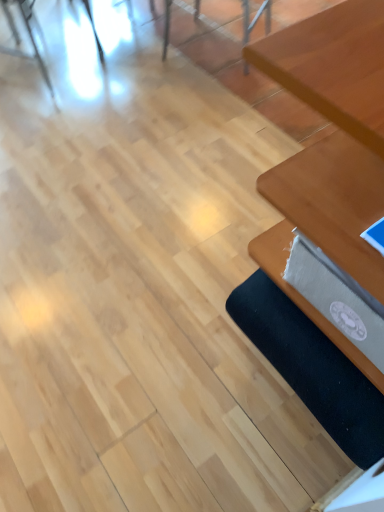
Find the location of a particular element. The width and height of the screenshot is (384, 512). vacant region to the left of wooden table at right is located at coordinates (182, 317).